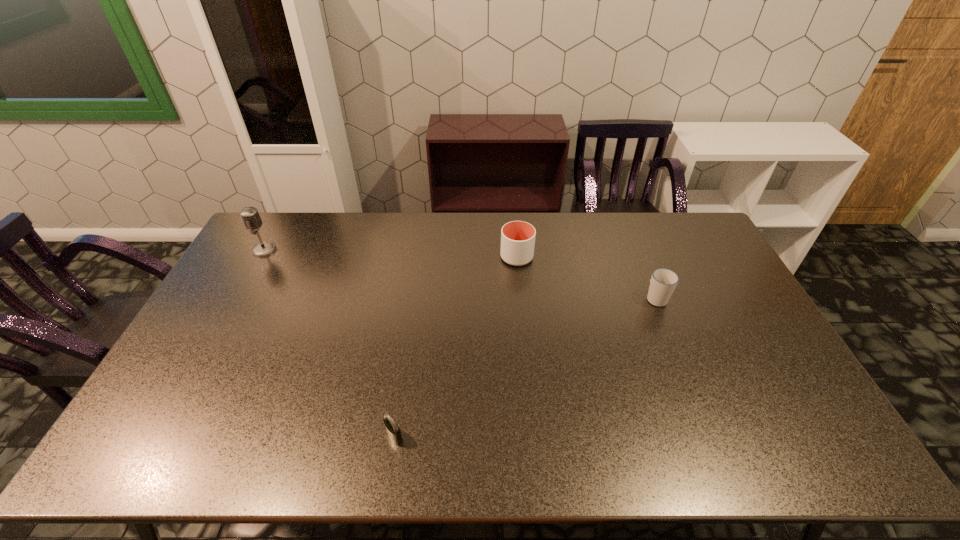
I want to click on vacant space at the near edge of the desktop, so click(351, 438).

In the image, there is a desktop. Where is `vacant space at the left edge`? Image resolution: width=960 pixels, height=540 pixels. vacant space at the left edge is located at coordinates (231, 272).

In the image, there is a desktop. Find the location of `vacant space at the right edge`. vacant space at the right edge is located at coordinates (795, 420).

You are a GUI agent. You are given a task and a screenshot of the screen. Output one action in this format:
    pyautogui.click(x=<x>, y=<y>)
    Task: Click on the free region at the far left corner of the desktop
    The image size is (960, 540).
    Given the screenshot: What is the action you would take?
    pyautogui.click(x=270, y=232)

At what (x,y) coordinates should I click in order to perform the action: click on vacant space at the near left corner of the desktop. Please return your answer as a coordinate pair (x, y). This screenshot has width=960, height=540. Looking at the image, I should click on (186, 460).

I want to click on free space between the third object from left to right and the nearest object, so click(x=456, y=347).

Locate an element on the screen. The image size is (960, 540). vacant space in between the tallest object and the shortest object is located at coordinates (329, 343).

Find the location of a particular element. The width and height of the screenshot is (960, 540). vacant area that lies between the farther cup and the leftmost object is located at coordinates (391, 253).

This screenshot has height=540, width=960. Find the location of `blank region between the padlock and the third object from left to right`. blank region between the padlock and the third object from left to right is located at coordinates (456, 347).

What are the coordinates of `free space between the right cup and the nearest object` in the screenshot? It's located at (525, 367).